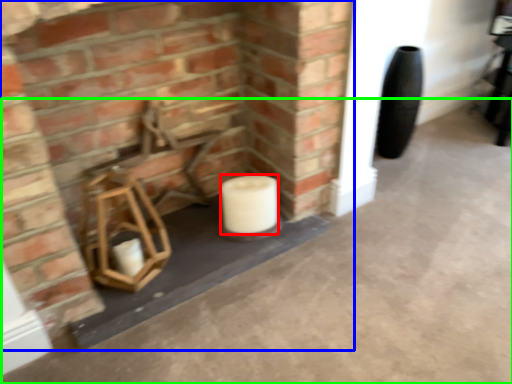
Question: Which object is positioned farthest from toilet paper (highlighted by a red box)? Select from fireplace (highlighted by a blue box) and concrete (highlighted by a green box).

Choices:
 (A) fireplace
 (B) concrete

Answer: (B)